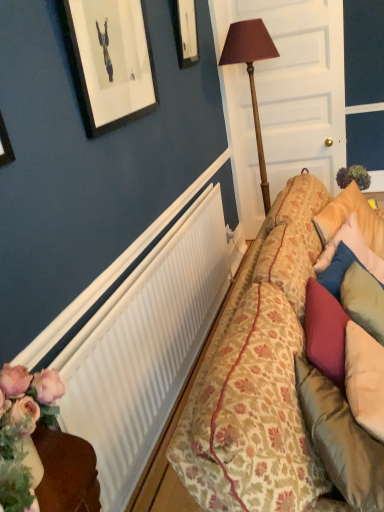
Question: Can you confirm if wooden picture frame at upper center is thinner than white wood door at center?

Choices:
 (A) yes
 (B) no

Answer: (A)

Question: Is wooden picture frame at upper center facing towards white wood door at center?

Choices:
 (A) yes
 (B) no

Answer: (B)

Question: Is wooden picture frame at upper center further to the viewer compared to white wood door at center?

Choices:
 (A) no
 (B) yes

Answer: (A)

Question: Can you confirm if wooden picture frame at upper center is positioned to the right of white wood door at center?

Choices:
 (A) no
 (B) yes

Answer: (A)

Question: Considering the relative sizes of wooden picture frame at upper center and white wood door at center in the image provided, is wooden picture frame at upper center bigger than white wood door at center?

Choices:
 (A) no
 (B) yes

Answer: (A)

Question: Based on their sizes in the image, would you say white wood door at center is bigger or smaller than wooden table lamp at center?

Choices:
 (A) big
 (B) small

Answer: (B)

Question: Looking at their shapes, would you say white wood door at center is wider or thinner than wooden table lamp at center?

Choices:
 (A) thin
 (B) wide

Answer: (A)

Question: Is white wood door at center spatially inside wooden table lamp at center, or outside of it?

Choices:
 (A) inside
 (B) outside

Answer: (B)

Question: Does point (291, 6) appear closer or farther from the camera than point (246, 62)?

Choices:
 (A) closer
 (B) farther

Answer: (B)

Question: Would you say white wood door at center is to the left or to the right of floral-patterned fabric couch at right in the picture?

Choices:
 (A) left
 (B) right

Answer: (B)

Question: From a real-world perspective, relative to floral-patterned fabric couch at right, is white wood door at center vertically above or below?

Choices:
 (A) below
 (B) above

Answer: (B)

Question: Considering the positions of white wood door at center and floral-patterned fabric couch at right in the image, is white wood door at center wider or thinner than floral-patterned fabric couch at right?

Choices:
 (A) thin
 (B) wide

Answer: (A)

Question: Is point (296, 26) closer or farther from the camera than point (299, 331)?

Choices:
 (A) closer
 (B) farther

Answer: (B)

Question: From their relative heights in the image, would you say wooden table lamp at center is taller or shorter than wooden picture frame at upper center?

Choices:
 (A) tall
 (B) short

Answer: (A)

Question: Would you say wooden table lamp at center is inside or outside wooden picture frame at upper center?

Choices:
 (A) inside
 (B) outside

Answer: (B)